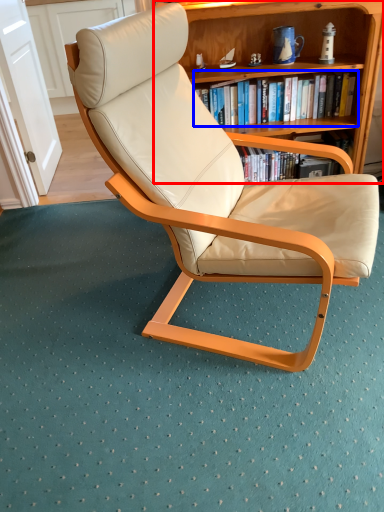
Question: Which object is closer to the camera taking this photo, bookcase (highlighted by a red box) or book (highlighted by a blue box)?

Choices:
 (A) bookcase
 (B) book

Answer: (A)